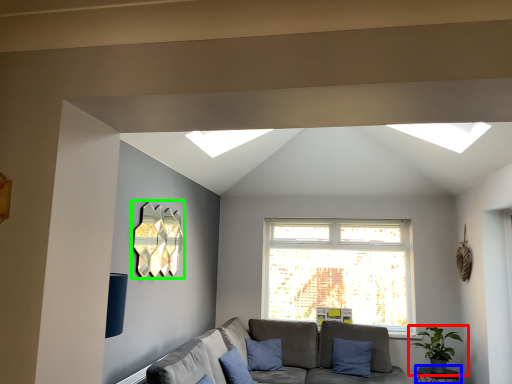
Question: Estimate the real-world distances between objects in this image. Which object is farther from houseplant (highlighted by a red box), table (highlighted by a blue box) or lamp (highlighted by a green box)?

Choices:
 (A) table
 (B) lamp

Answer: (B)